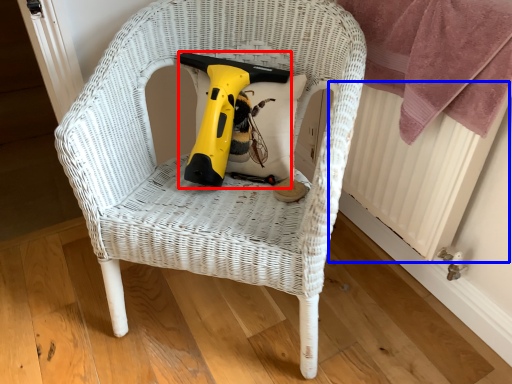
Question: Among these objects, which one is nearest to the camera, electric drill (highlighted by a red box) or radiator (highlighted by a blue box)?

Choices:
 (A) electric drill
 (B) radiator

Answer: (B)